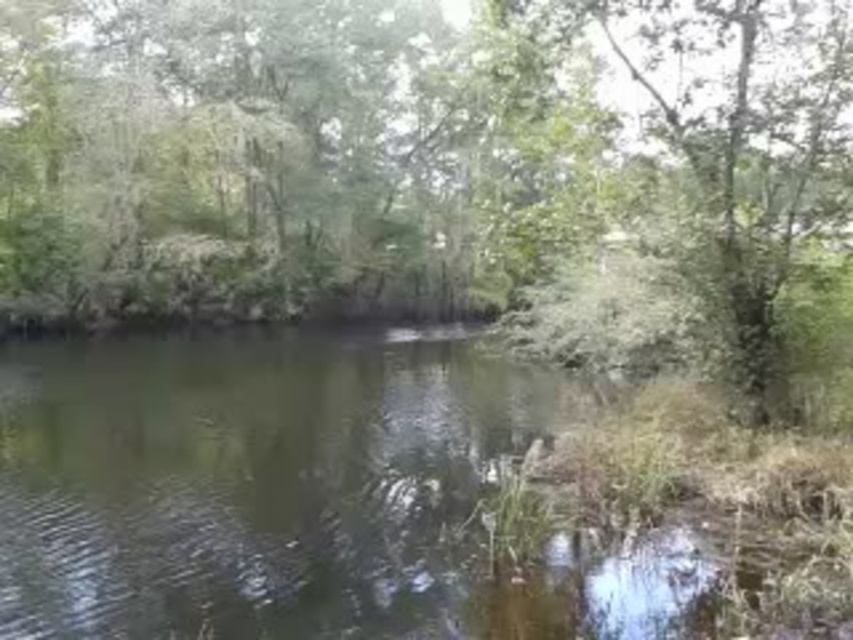
Question: Which point is closer to the camera taking this photo?

Choices:
 (A) (460, 506)
 (B) (131, 224)

Answer: (A)

Question: In this image, where is green leafy tree at center located relative to green grassy river at center?

Choices:
 (A) right
 (B) left

Answer: (B)

Question: Does green leafy tree at center appear on the left side of green grassy river at center?

Choices:
 (A) yes
 (B) no

Answer: (A)

Question: Does green leafy tree at center have a larger size compared to green grassy river at center?

Choices:
 (A) no
 (B) yes

Answer: (B)